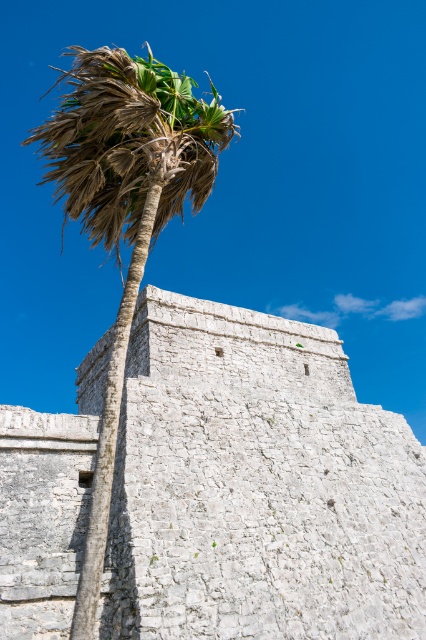
Question: Can you confirm if white stone wall at center is positioned above brown leafy palm tree at left?

Choices:
 (A) no
 (B) yes

Answer: (A)

Question: Among these objects, which one is farthest from the camera?

Choices:
 (A) brown leafy palm tree at left
 (B) white stone wall at center

Answer: (B)

Question: Is white stone wall at center positioned at the back of brown leafy palm tree at left?

Choices:
 (A) yes
 (B) no

Answer: (A)

Question: Which point appears farthest from the camera in this image?

Choices:
 (A) (92, 154)
 (B) (365, 481)

Answer: (B)

Question: Is white stone wall at center above brown leafy palm tree at left?

Choices:
 (A) no
 (B) yes

Answer: (A)

Question: Which point appears closest to the camera in this image?

Choices:
 (A) (123, 129)
 (B) (351, 536)

Answer: (A)